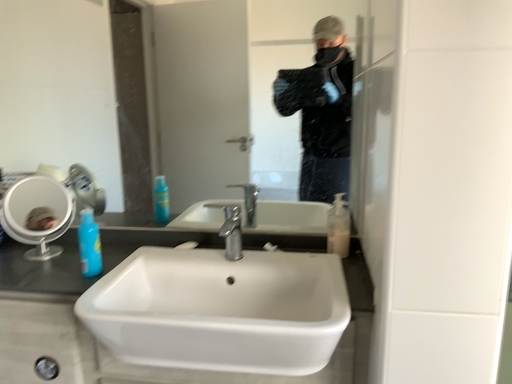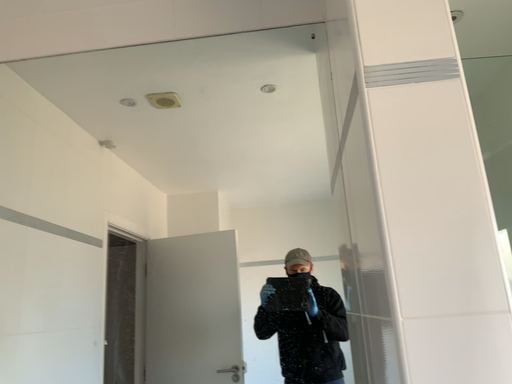
Question: Which way did the camera rotate in the video?

Choices:
 (A) rotated downward
 (B) rotated upward

Answer: (B)